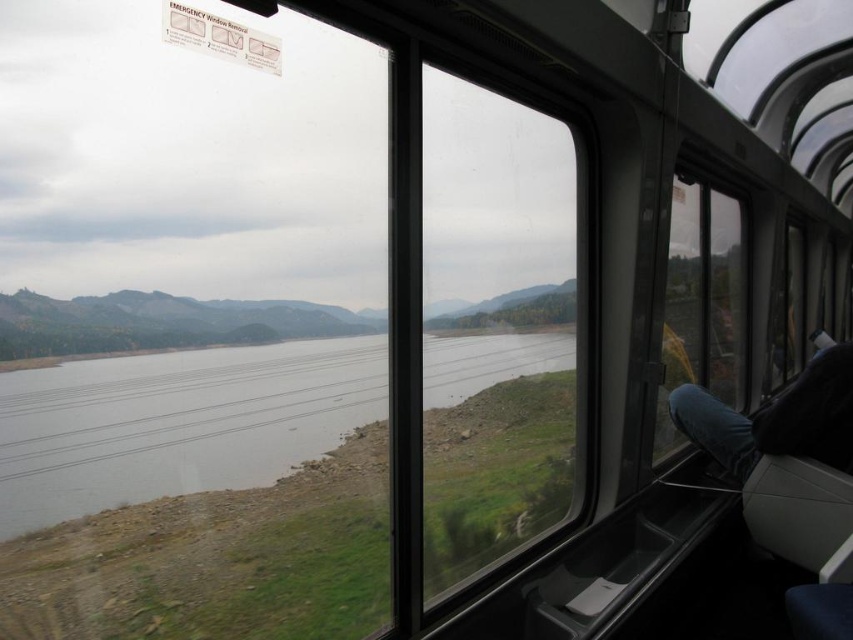
You are sitting in the train and looking out the window. You see the gray water at center and the jeans at right. Which object is closer to the train window?

The jeans at right are closer to the train window because the gray water at center is located above them, meaning the jeans are in front.

You are sitting in the train and looking out through the window. There are two points marked on the window at coordinates point [167,460] and point [763,452]. Which point is closer to your eyes?

Point [167,460] is closer to the camera than point [763,452].

You are a passenger sitting on the train and want to know if the gray water at center in the view is narrower than the jeans at right. Can you confirm this?

The gray water at center is indeed narrower than the jeans at right, as its width is less than that of the jeans.